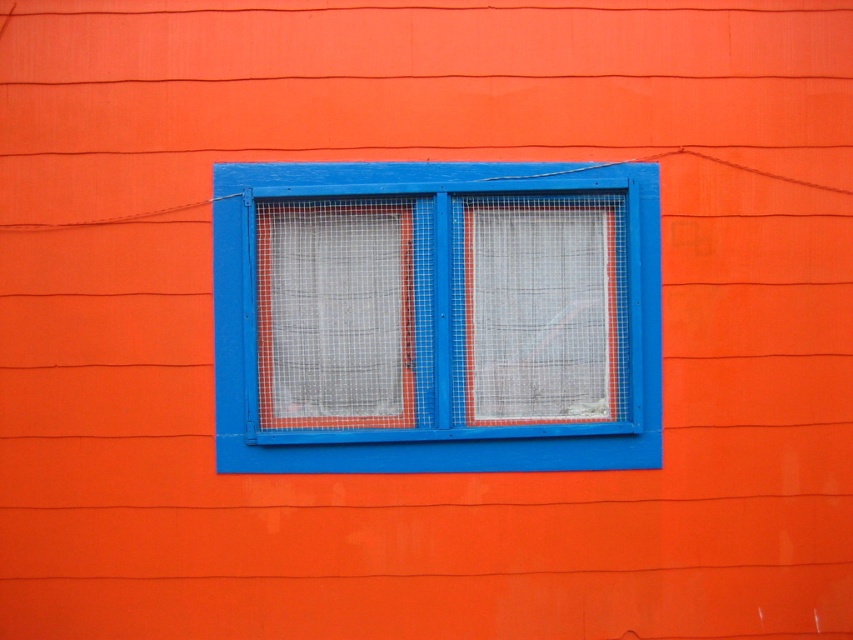
Question: Which of the following is the farthest from the observer?

Choices:
 (A) (564, 416)
 (B) (503, 436)
 (C) (300, 276)

Answer: (A)

Question: Is blue painted wood window at center smaller than metal mesh screen at center?

Choices:
 (A) yes
 (B) no

Answer: (B)

Question: Does blue painted wood window at center lie behind metal mesh screen at center?

Choices:
 (A) yes
 (B) no

Answer: (B)

Question: Based on their relative distances, which object is farther from the metal mesh screen at center?

Choices:
 (A) white mesh screen at center
 (B) blue painted wood window at center

Answer: (A)

Question: Which point is farther to the camera?

Choices:
 (A) metal mesh screen at center
 (B) blue painted wood window at center

Answer: (A)

Question: Is metal mesh screen at center behind white mesh screen at center?

Choices:
 (A) yes
 (B) no

Answer: (B)